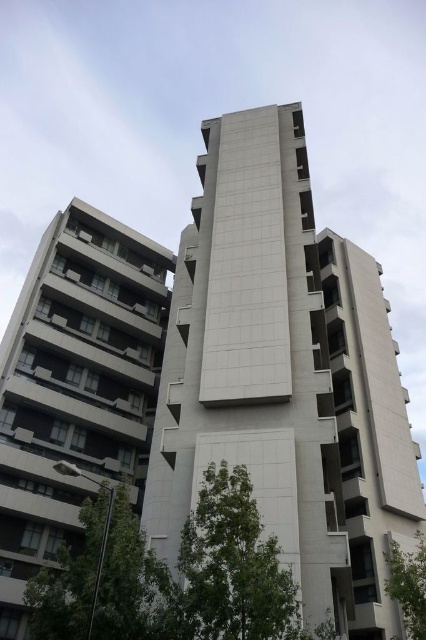
You are standing at the base of the building on the right. Looking towards the building on the left, where is the green leafy tree at lower center located relative to the buildings?

The green leafy tree at lower center is located at point [233,564], which is in the lower center area between the two buildings.

You are standing in front of the two modern high rise buildings. You notice two green leafy trees in the foreground. Which tree is nearer to you, the green leafy tree at lower left or the green leafy tree at lower right?

The green leafy tree at lower left is closer to the viewer than the green leafy tree at lower right.

You are standing in front of the two modern high rise buildings. You notice two points marked on the buildings. The first point is at coordinate point (258, 548) and the second is at point (112, 602). Which point is closer to you?

Point (258, 548) is further to the viewer than point (112, 602), so the point closer to you is point (112, 602).